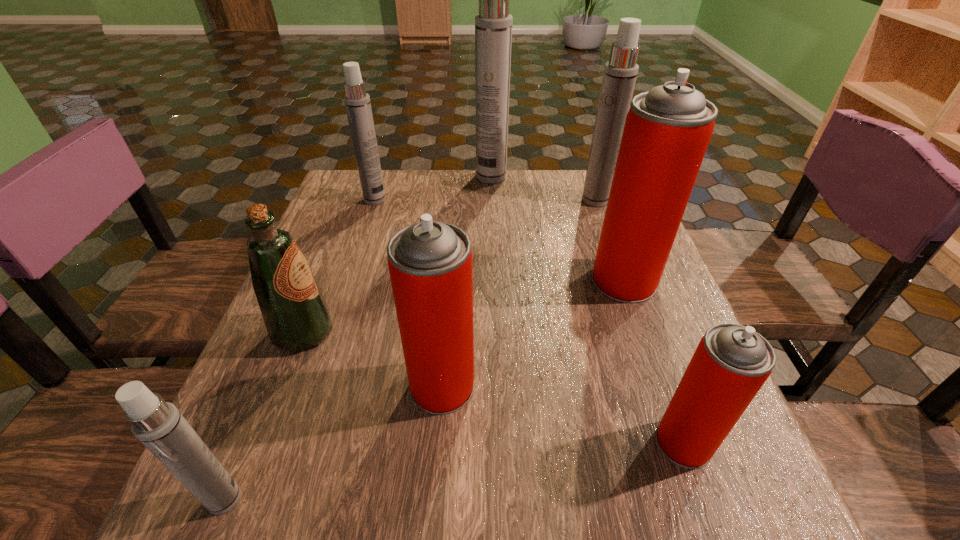
This screenshot has height=540, width=960. I want to click on the biggest white aerosol can, so click(x=493, y=25).

Locate an element on the screen. The width and height of the screenshot is (960, 540). the tallest object is located at coordinates (493, 25).

Image resolution: width=960 pixels, height=540 pixels. I want to click on the rightmost white aerosol can, so click(620, 73).

Find the location of a particular element. the fourth farthest aerosol can is located at coordinates (667, 130).

I want to click on the biggest red aerosol can, so click(667, 130).

Identify the location of the leftmost red aerosol can. This screenshot has width=960, height=540. (430, 263).

Identify the location of the third nearest aerosol can. The image size is (960, 540). (430, 263).

Identify the location of the sixth aerosol can from right to left. This screenshot has width=960, height=540. (357, 102).

Where is `the third biggest white aerosol can`? The width and height of the screenshot is (960, 540). the third biggest white aerosol can is located at coordinates (357, 102).

What are the coordinates of `green olive oil` in the screenshot? It's located at (295, 313).